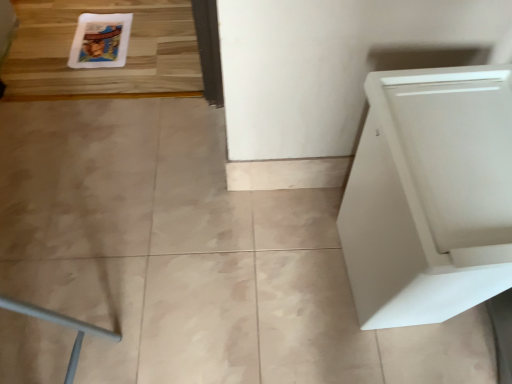
Question: From a real-world perspective, is white glossy comic book at upper left above or below white matte cabinet at right?

Choices:
 (A) above
 (B) below

Answer: (B)

Question: Considering the positions of white glossy comic book at upper left and white matte cabinet at right in the image, is white glossy comic book at upper left taller or shorter than white matte cabinet at right?

Choices:
 (A) tall
 (B) short

Answer: (B)

Question: From the image's perspective, is white glossy comic book at upper left located above or below white matte cabinet at right?

Choices:
 (A) below
 (B) above

Answer: (B)

Question: Based on their positions, is white matte cabinet at right located to the left or right of white glossy comic book at upper left?

Choices:
 (A) left
 (B) right

Answer: (B)

Question: Considering the positions of point (373, 134) and point (120, 61), is point (373, 134) closer or farther from the camera than point (120, 61)?

Choices:
 (A) closer
 (B) farther

Answer: (A)

Question: Considering the positions of white matte cabinet at right and white glossy comic book at upper left in the image, is white matte cabinet at right wider or thinner than white glossy comic book at upper left?

Choices:
 (A) wide
 (B) thin

Answer: (B)

Question: In terms of size, does white matte cabinet at right appear bigger or smaller than white glossy comic book at upper left?

Choices:
 (A) big
 (B) small

Answer: (A)